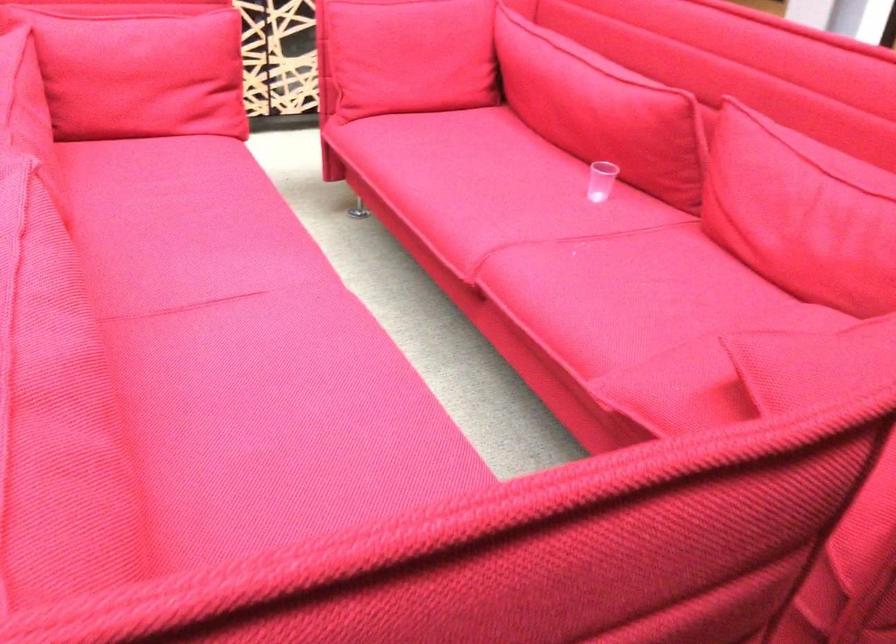
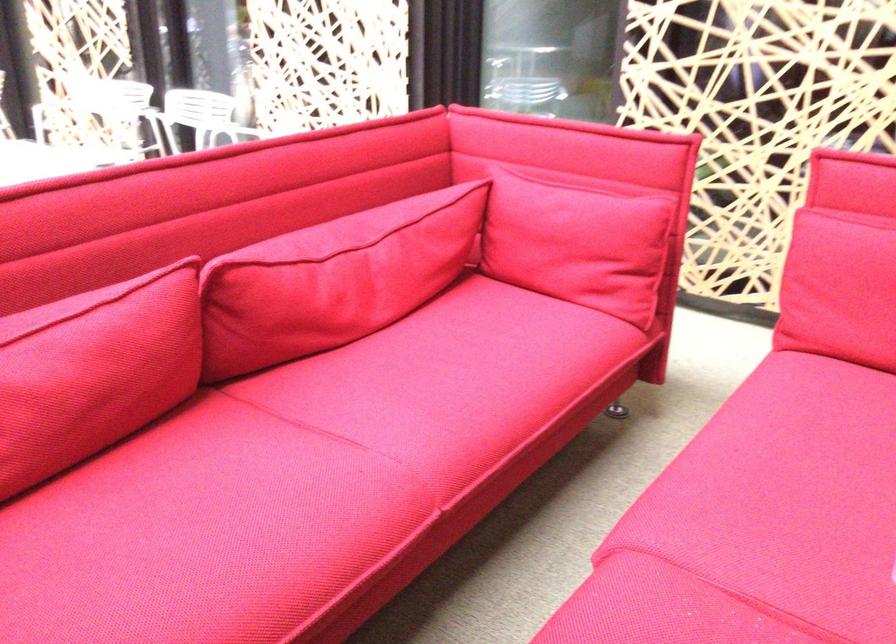
The point at (192, 78) is marked in the first image. Where is the corresponding point in the second image?

(578, 243)